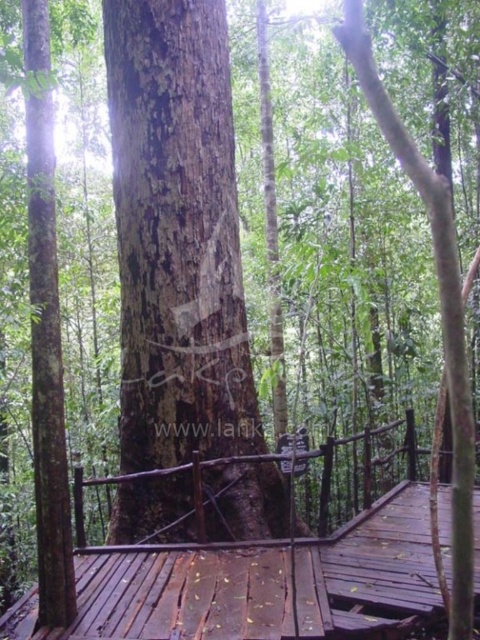
Question: Does brown wooden bridge at center appear on the right side of brown rough tree trunk at center?

Choices:
 (A) no
 (B) yes

Answer: (B)

Question: Which object is farther from the camera taking this photo?

Choices:
 (A) brown wooden bridge at center
 (B) brown rough tree trunk at center
 (C) dark brown rough bark tree trunk at center

Answer: (C)

Question: Is brown wooden bridge at center to the left of brown rough tree trunk at center from the viewer's perspective?

Choices:
 (A) no
 (B) yes

Answer: (A)

Question: Which point is closer to the camera?

Choices:
 (A) brown wooden bridge at center
 (B) brown rough tree trunk at center
 (C) dark brown rough bark tree trunk at center

Answer: (B)

Question: Can you confirm if brown wooden bridge at center is thinner than brown rough tree trunk at center?

Choices:
 (A) yes
 (B) no

Answer: (B)

Question: Which point is farther to the camera?

Choices:
 (A) (169, 276)
 (B) (360, 632)
 (C) (433, 244)

Answer: (A)